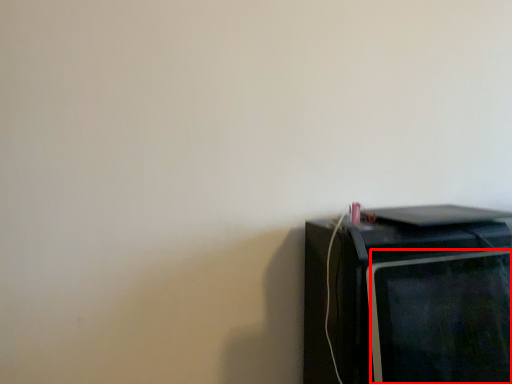
Question: From the image's perspective, what is the correct spatial relationship of computer monitor (annotated by the red box) in relation to home appliance?

Choices:
 (A) above
 (B) below

Answer: (A)